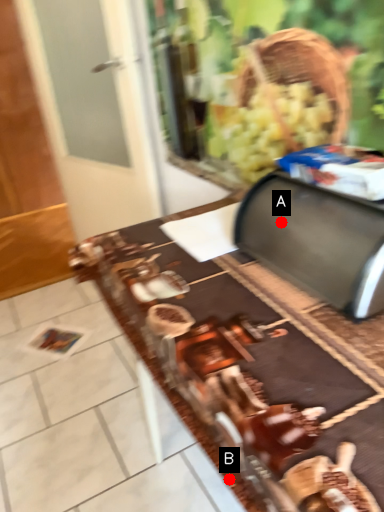
Question: Two points are circled on the image, labeled by A and B beside each circle. Among these points, which one is farthest from the camera?

Choices:
 (A) A is further
 (B) B is further

Answer: (A)